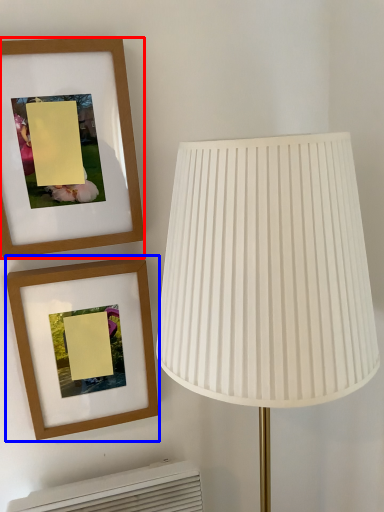
Question: Which point is closer to the camera, picture frame (highlighted by a red box) or picture frame (highlighted by a blue box)?

Choices:
 (A) picture frame
 (B) picture frame

Answer: (A)